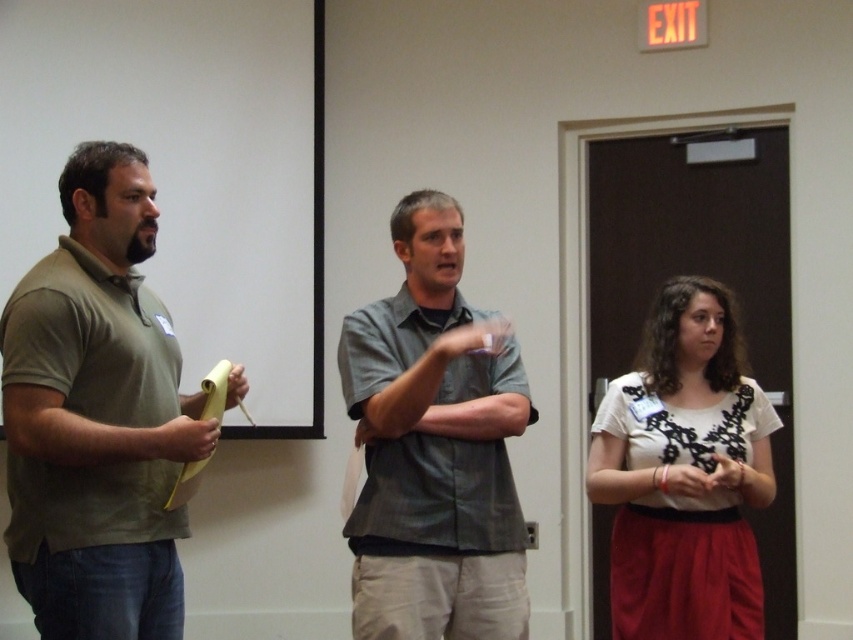
Question: Which of the following is the farthest from the observer?

Choices:
 (A) (432, 211)
 (B) (115, 141)

Answer: (B)

Question: Is gray cotton shirt at center to the left of white lace fabric at center from the viewer's perspective?

Choices:
 (A) yes
 (B) no

Answer: (A)

Question: Can you confirm if matte green polo shirt at left is wider than gray cotton shirt at center?

Choices:
 (A) yes
 (B) no

Answer: (B)

Question: Is matte green polo shirt at left wider than gray cotton shirt at center?

Choices:
 (A) yes
 (B) no

Answer: (B)

Question: Which point is farther to the camera?

Choices:
 (A) matte green polo shirt at left
 (B) white lace fabric at center

Answer: (B)

Question: Which point appears closest to the camera in this image?

Choices:
 (A) (718, 472)
 (B) (474, 472)
 (C) (164, 573)

Answer: (C)